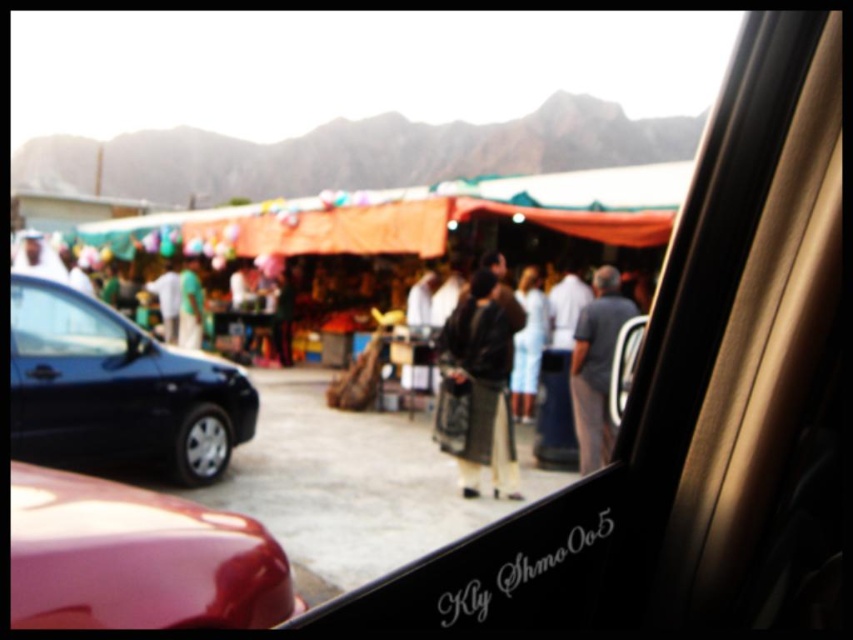
This screenshot has height=640, width=853. Identify the location of black glossy car at left. (117, 388).

Does point (10, 340) lie in front of point (445, 371)?

Yes, point (10, 340) is closer to viewer.

Who is more forward, (219,388) or (491,323)?

Point (491,323) is more forward.

The width and height of the screenshot is (853, 640). Find the location of `black glossy car at left`. black glossy car at left is located at coordinates (117, 388).

Which is behind, point (265, 540) or point (193, 342)?

Point (193, 342)

Which is more to the left, glossy red car at lower left or green fabric bag at center?

Positioned to the left is green fabric bag at center.

Who is more distant from viewer, (x=196, y=557) or (x=189, y=346)?

Positioned behind is point (x=189, y=346).

Image resolution: width=853 pixels, height=640 pixels. Identify the location of glossy red car at lower left. (136, 557).

Based on the photo, between glossy red car at lower left and black glossy car at left, which one has less height?

With less height is glossy red car at lower left.

Does glossy red car at lower left appear on the left side of black glossy car at left?

No, glossy red car at lower left is not to the left of black glossy car at left.

What do you see at coordinates (136, 557) in the screenshot? The height and width of the screenshot is (640, 853). I see `glossy red car at lower left` at bounding box center [136, 557].

Where is `glossy red car at lower left`? This screenshot has width=853, height=640. glossy red car at lower left is located at coordinates (136, 557).